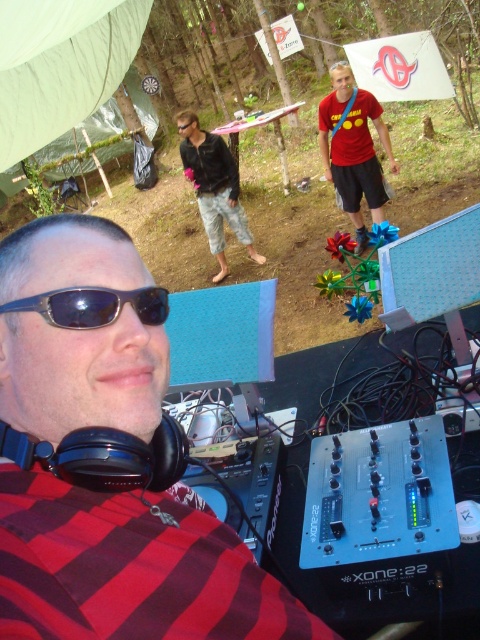
The width and height of the screenshot is (480, 640). I want to click on denim shorts at center, so click(215, 189).

The image size is (480, 640). Describe the element at coordinates (215, 189) in the screenshot. I see `denim shorts at center` at that location.

Is point (229, 188) positioned in front of point (157, 296)?

No, (229, 188) is behind (157, 296).

Identify the location of denim shorts at center. The image size is (480, 640). (215, 189).

Is matte red t-shirt at center further to the viewer compared to denim shorts at center?

No.

Where is `matte red t-shirt at center`? Image resolution: width=480 pixels, height=640 pixels. matte red t-shirt at center is located at coordinates (354, 148).

Consider the image. Between black matte headphones at lower left and denim shorts at center, which one appears on the left side from the viewer's perspective?

denim shorts at center

Measure the distance between black matte headphones at lower left and denim shorts at center.

black matte headphones at lower left and denim shorts at center are 5.85 meters apart.

Which is in front, point (15, 531) or point (240, 220)?

Positioned in front is point (15, 531).

The height and width of the screenshot is (640, 480). I want to click on black matte headphones at lower left, so click(x=132, y=568).